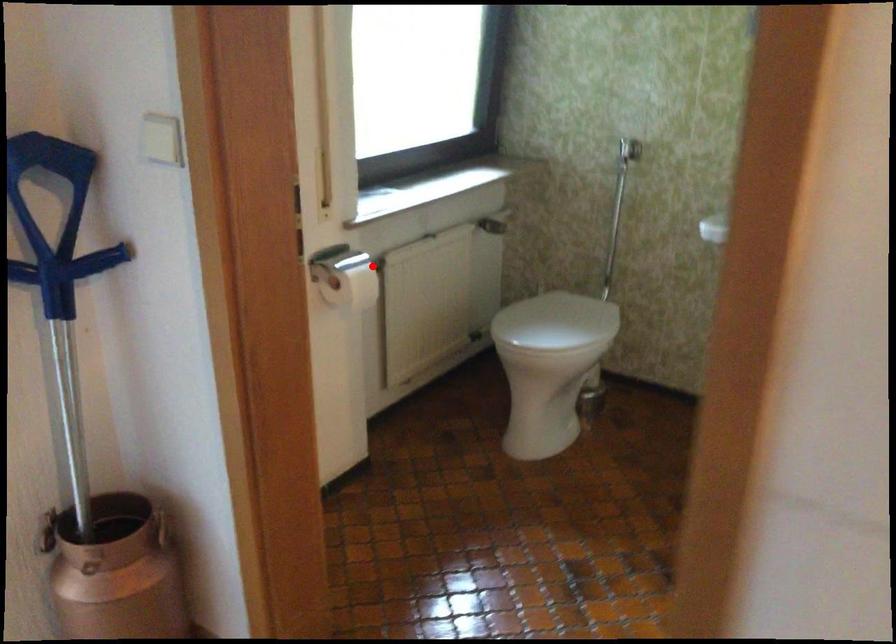
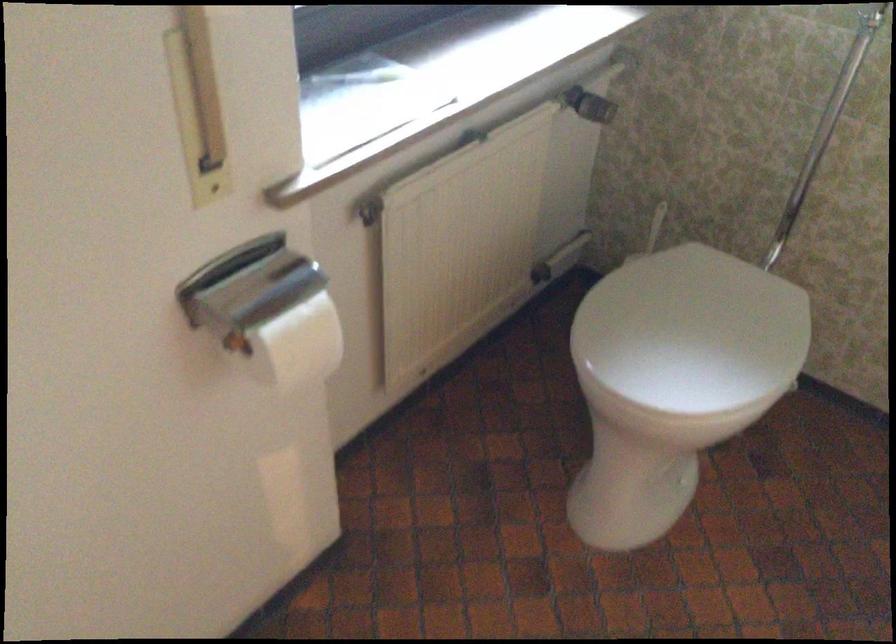
Find the pixel in the second image that matches the highlighted location in the first image.

(368, 212)